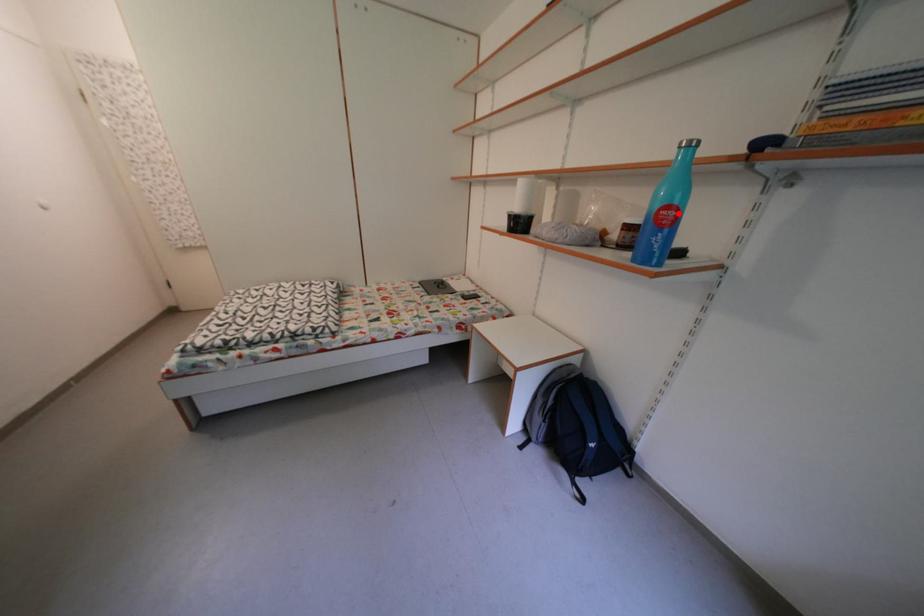
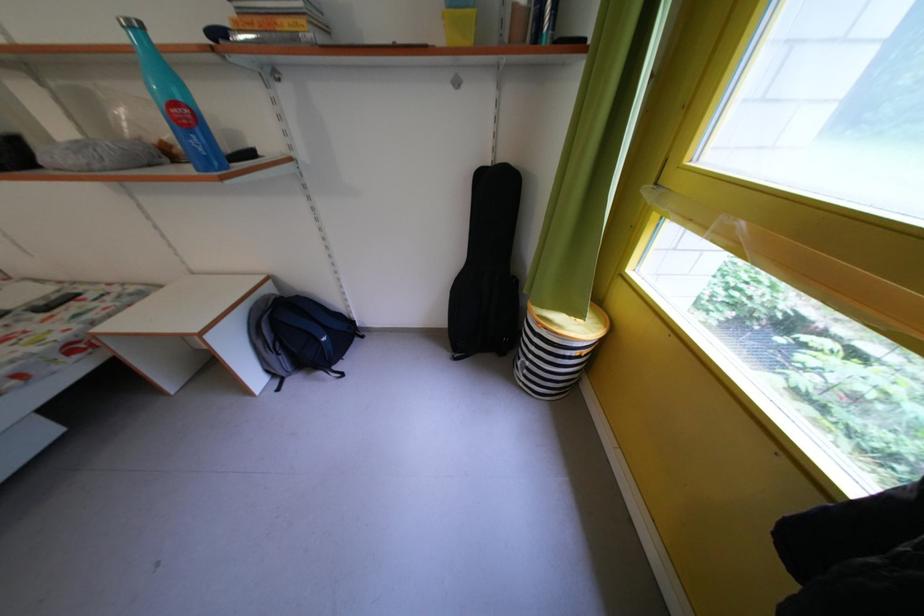
Find the pixel in the second image that matches the highlighted location in the first image.

(185, 110)